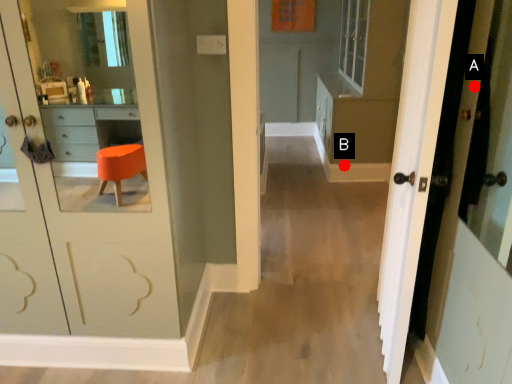
Question: Two points are circled on the image, labeled by A and B beside each circle. Which point is farther to the camera?

Choices:
 (A) A is further
 (B) B is further

Answer: (B)